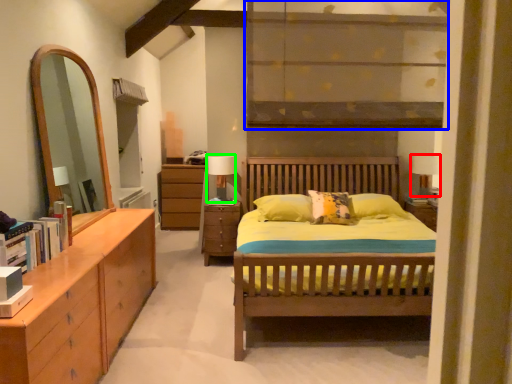
Question: Estimate the real-world distances between objects in this image. Which object is farther from table lamp (highlighted by a red box), shelf (highlighted by a blue box) or table lamp (highlighted by a green box)?

Choices:
 (A) shelf
 (B) table lamp

Answer: (A)